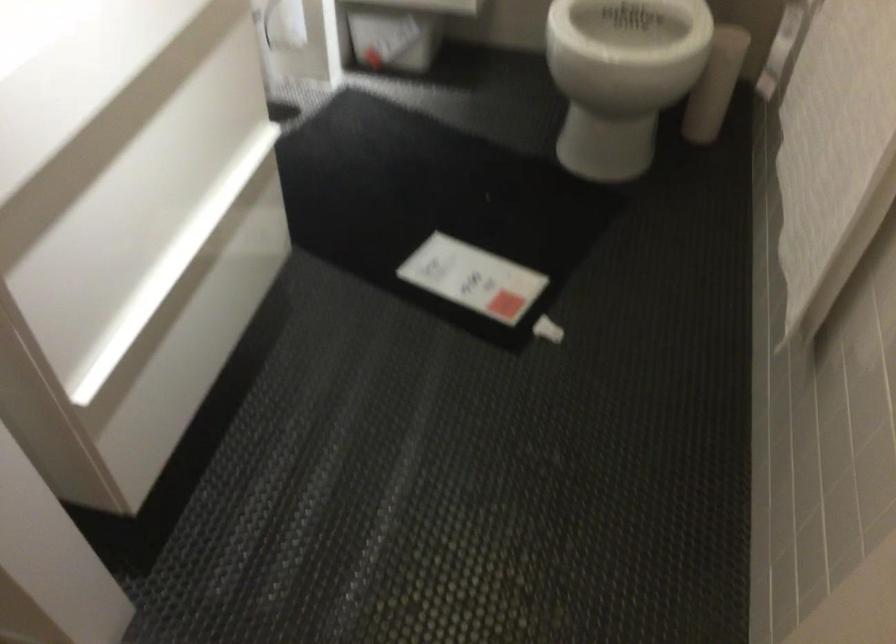
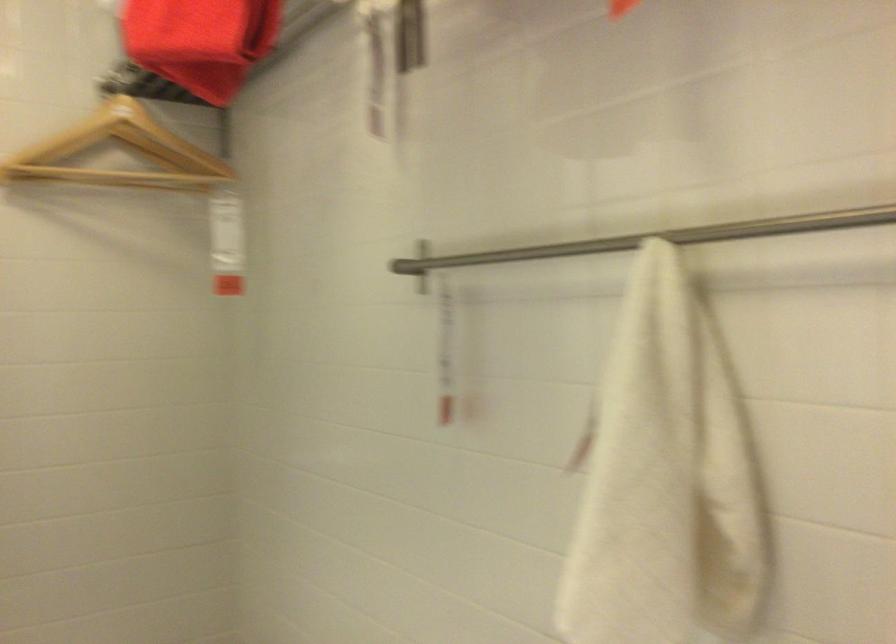
Based on the continuous images, in which direction is the camera rotating?

The camera's rotation is toward right-up.